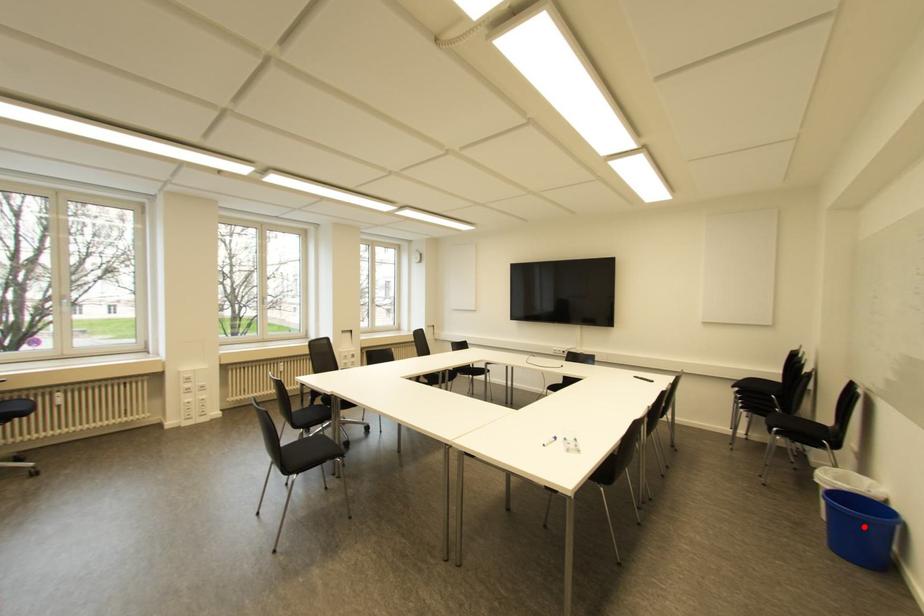
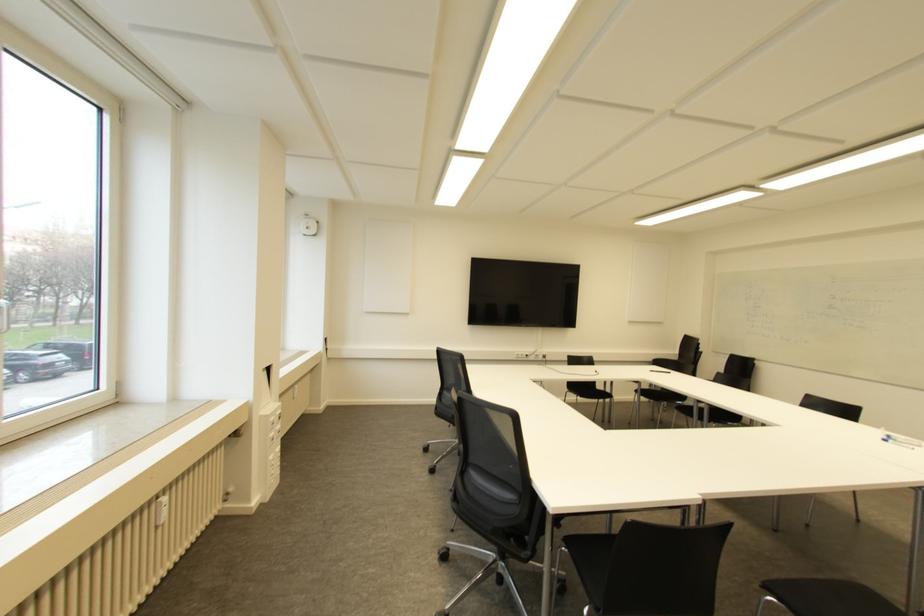
Question: I am providing you with two images of the same scene from different viewpoints. A red point is marked on the first image. Can you still see the location of the red point in image 2?

Choices:
 (A) Yes
 (B) No

Answer: (B)